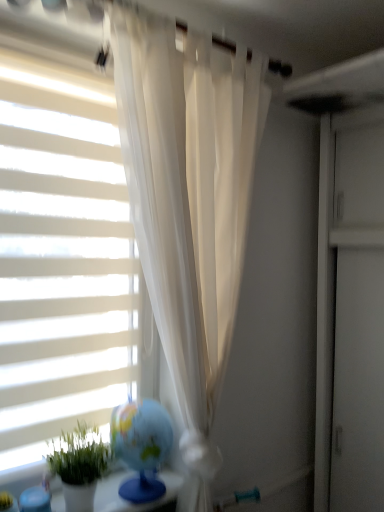
Question: Considering the positions of white matte window blind at left and green matte plant at lower left in the image, is white matte window blind at left bigger or smaller than green matte plant at lower left?

Choices:
 (A) small
 (B) big

Answer: (B)

Question: From a real-world perspective, relative to green matte plant at lower left, is white matte window blind at left vertically above or below?

Choices:
 (A) below
 (B) above

Answer: (B)

Question: Considering the positions of white matte window blind at left and green matte plant at lower left in the image, is white matte window blind at left wider or thinner than green matte plant at lower left?

Choices:
 (A) wide
 (B) thin

Answer: (B)

Question: Considering the positions of green matte plant at lower left and white matte window blind at left in the image, is green matte plant at lower left taller or shorter than white matte window blind at left?

Choices:
 (A) tall
 (B) short

Answer: (B)

Question: Considering the relative positions of green matte plant at lower left and white matte window blind at left in the image provided, is green matte plant at lower left to the left or to the right of white matte window blind at left?

Choices:
 (A) right
 (B) left

Answer: (A)

Question: In terms of size, does green matte plant at lower left appear bigger or smaller than white matte window blind at left?

Choices:
 (A) small
 (B) big

Answer: (A)

Question: Does point (82, 457) appear closer or farther from the camera than point (26, 147)?

Choices:
 (A) closer
 (B) farther

Answer: (B)